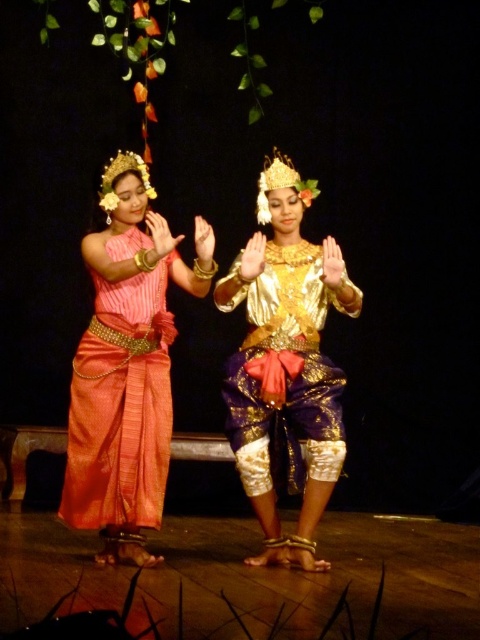
You are a photographer positioned at the back of the stage. You need to capture a photo where both the silk sari at center and the gold shiny blouse at center are visible. Based on their positions, which one should you focus on first to ensure both are in frame?

The silk sari at center is to the left of the gold shiny blouse at center. Since you are at the back of the stage, focusing on the gold shiny blouse at center first will allow you to include the silk sari at center to its left in the frame as well.